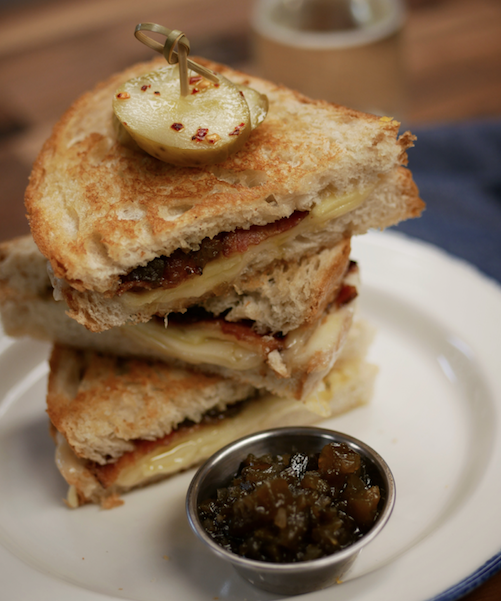
Image resolution: width=501 pixels, height=601 pixels. Identify the location of napkin. (443, 215).